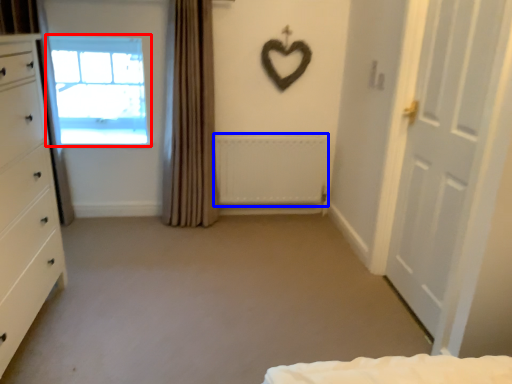
Question: Which object is closer to the camera taking this photo, window (highlighted by a red box) or radiator (highlighted by a blue box)?

Choices:
 (A) window
 (B) radiator

Answer: (B)